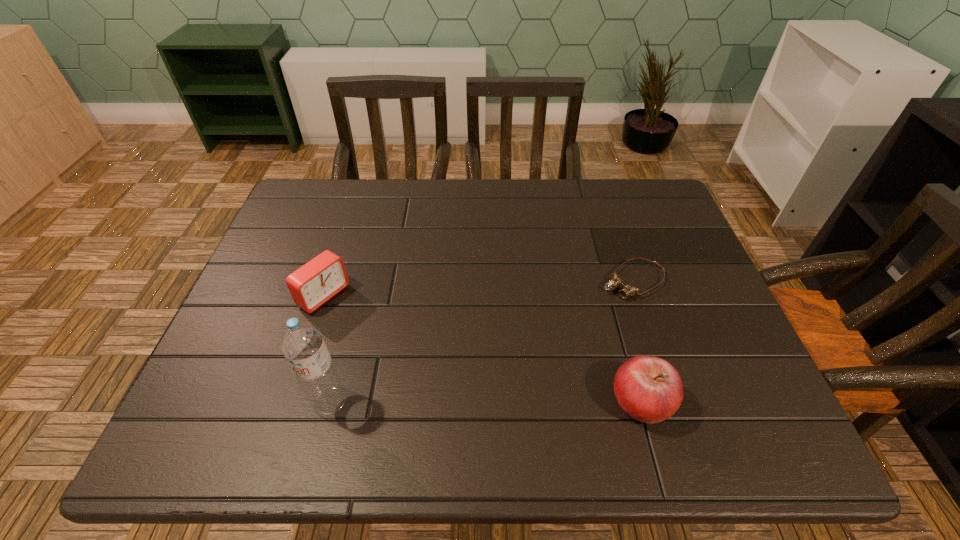
This screenshot has height=540, width=960. I want to click on free space at the far right corner, so click(636, 201).

You are a GUI agent. You are given a task and a screenshot of the screen. Output one action in this format:
    pyautogui.click(x=<x>, y=<y>)
    Task: Click on the free space between the shortest object and the water bottle
    This screenshot has width=960, height=540.
    Given the screenshot: What is the action you would take?
    pos(481,341)

Image resolution: width=960 pixels, height=540 pixels. In order to click on empty location between the alarm clock and the apple in this screenshot , I will do `click(483, 349)`.

Identify the location of free space between the alarm clock and the goggles. (478, 288).

Where is `vacant space that is in between the tallest object and the shortest object`? vacant space that is in between the tallest object and the shortest object is located at coordinates (481, 341).

In order to click on empty space that is in between the water bottle and the shortest object in this screenshot , I will do `click(481, 341)`.

Locate an element on the screen. The width and height of the screenshot is (960, 540). blank region between the alarm clock and the shortest object is located at coordinates (478, 288).

The height and width of the screenshot is (540, 960). I want to click on vacant area between the tallest object and the third shortest object, so click(486, 401).

Identify the location of unoccupied area between the second shortest object and the shortest object. (478, 288).

Locate an element on the screen. Image resolution: width=960 pixels, height=540 pixels. free space between the second tallest object and the second shortest object is located at coordinates (483, 349).